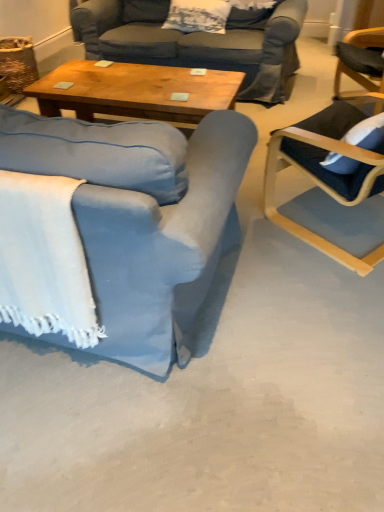
Find the location of a particular element. free spot above wooden coffee table at center (from a real-world perspective) is located at coordinates (131, 84).